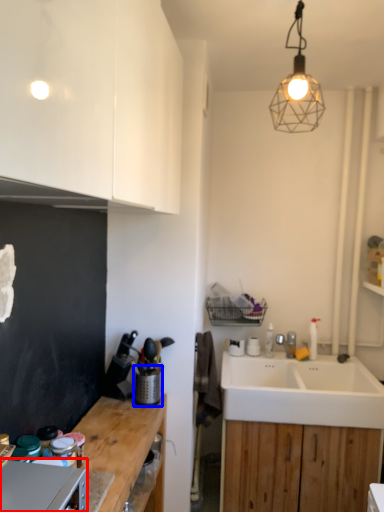
Question: Which object appears closest to the camera in this image, appliance (highlighted by a red box) or appliance (highlighted by a blue box)?

Choices:
 (A) appliance
 (B) appliance

Answer: (A)